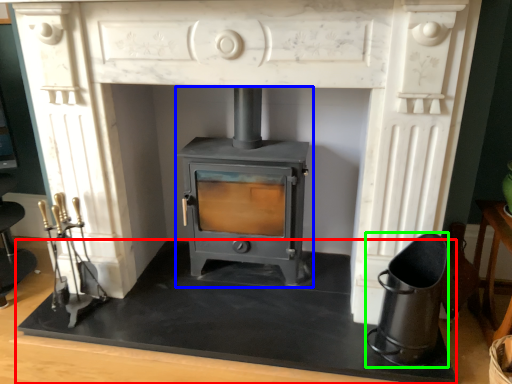
Question: Which is farther away from slate (highlighted by a red box)? wood burning stove (highlighted by a blue box) or appliance (highlighted by a green box)?

Choices:
 (A) wood burning stove
 (B) appliance

Answer: (B)